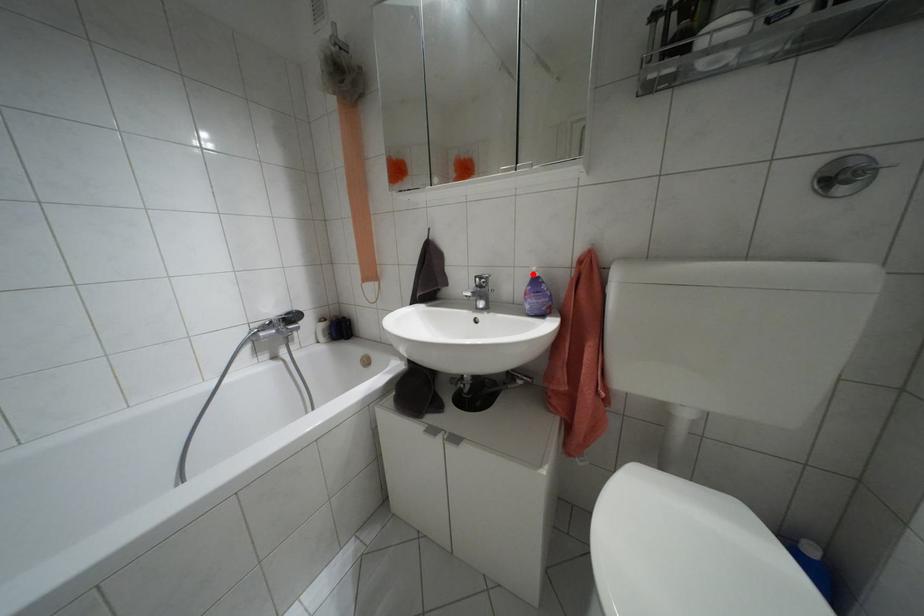
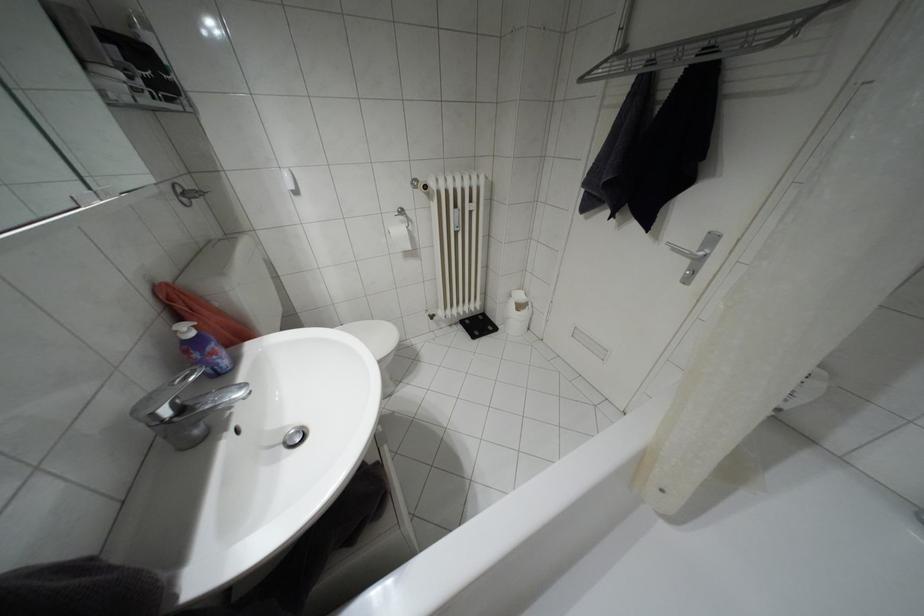
Find the pixel in the second image that matches the highlighted location in the first image.

(190, 333)